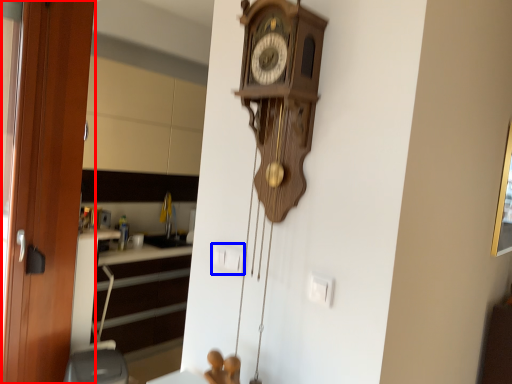
Question: Which object is further to the camera taking this photo, door (highlighted by a red box) or electric outlet (highlighted by a blue box)?

Choices:
 (A) door
 (B) electric outlet

Answer: (A)